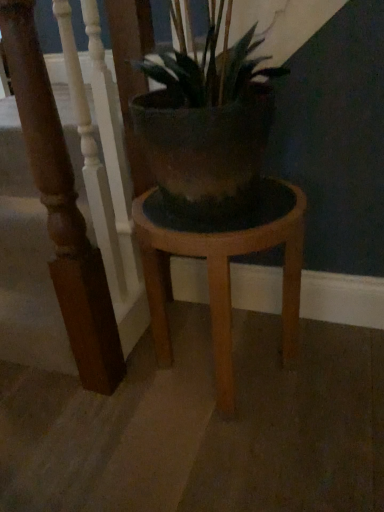
Identify the location of spots to the right of wooden stool at center. Image resolution: width=384 pixels, height=512 pixels. (336, 370).